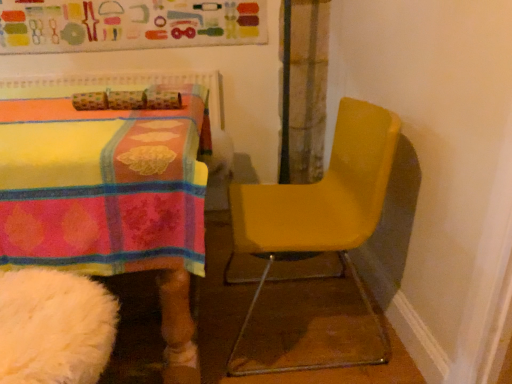
Question: From their relative heights in the image, would you say matte fabric bulletin board at upper center is taller or shorter than yellow matte chair at right?

Choices:
 (A) short
 (B) tall

Answer: (A)

Question: Based on their positions, is matte fabric bulletin board at upper center located to the left or right of yellow matte chair at right?

Choices:
 (A) left
 (B) right

Answer: (A)

Question: Considering their positions, is matte fabric bulletin board at upper center located in front of or behind yellow matte chair at right?

Choices:
 (A) front
 (B) behind

Answer: (B)

Question: Considering the positions of yellow matte chair at right and matte fabric bulletin board at upper center in the image, is yellow matte chair at right bigger or smaller than matte fabric bulletin board at upper center?

Choices:
 (A) big
 (B) small

Answer: (A)

Question: In terms of height, does yellow matte chair at right look taller or shorter compared to matte fabric bulletin board at upper center?

Choices:
 (A) tall
 (B) short

Answer: (A)

Question: From a real-world perspective, relative to matte fabric bulletin board at upper center, is yellow matte chair at right vertically above or below?

Choices:
 (A) below
 (B) above

Answer: (A)

Question: Relative to matte fabric bulletin board at upper center, is yellow matte chair at right in front or behind?

Choices:
 (A) behind
 (B) front

Answer: (B)